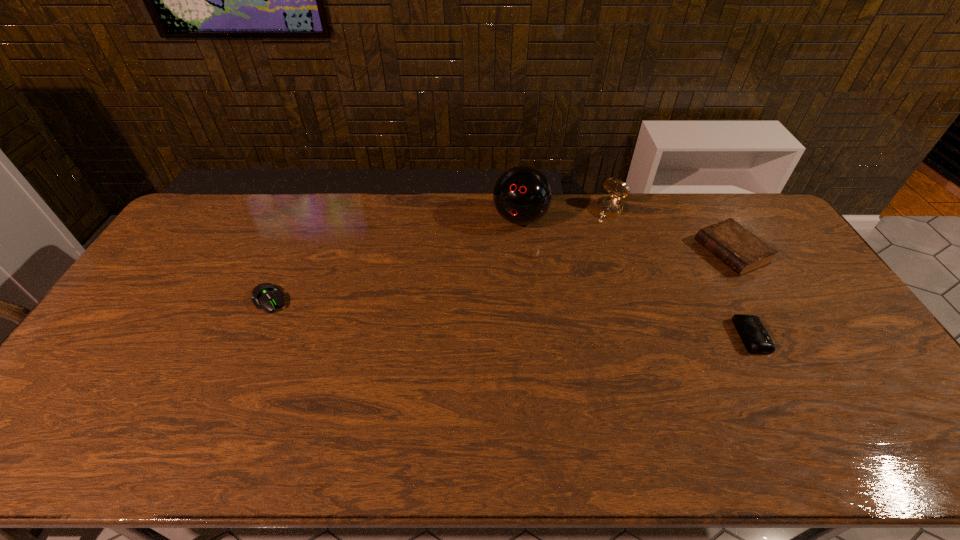
At what (x,y) coordinates should I click in order to perform the action: click on unoccupied area between the tallest object and the nearest object. Please return your answer as a coordinate pair (x, y). The height and width of the screenshot is (540, 960). Looking at the image, I should click on (636, 278).

You are a GUI agent. You are given a task and a screenshot of the screen. Output one action in this format:
    pyautogui.click(x=<x>, y=<y>)
    Task: Click on the unoccupied position between the bowling ball and the third shortest object
    
    Given the screenshot: What is the action you would take?
    pyautogui.click(x=626, y=235)

At what (x,y) coordinates should I click in order to perform the action: click on vacant area that lies between the leftmost object and the nearest object. Please return your answer as a coordinate pair (x, y). Looking at the image, I should click on (511, 318).

At what (x,y) coordinates should I click in order to perform the action: click on empty space that is in between the nearest object and the third shortest object. Please return your answer as a coordinate pair (x, y). The height and width of the screenshot is (540, 960). Looking at the image, I should click on (742, 294).

At what (x,y) coordinates should I click in order to perform the action: click on vacant space that is in between the diary and the fourth object from right to left. Please return your answer as a coordinate pair (x, y). This screenshot has width=960, height=540. Looking at the image, I should click on (626, 235).

This screenshot has height=540, width=960. I want to click on blank region between the leftmost object and the alarm clock, so click(x=511, y=318).

The height and width of the screenshot is (540, 960). What are the coordinates of `free space between the third tallest object and the bowling ball` in the screenshot? It's located at (626, 235).

Locate an element on the screen. Image resolution: width=960 pixels, height=540 pixels. blank region between the tallest object and the second tallest object is located at coordinates (565, 214).

Locate an element on the screen. The height and width of the screenshot is (540, 960). object that is the fourth nearest to the alarm clock is located at coordinates (265, 295).

Where is `object that stands as the closest to the nearest object`? This screenshot has width=960, height=540. object that stands as the closest to the nearest object is located at coordinates (742, 251).